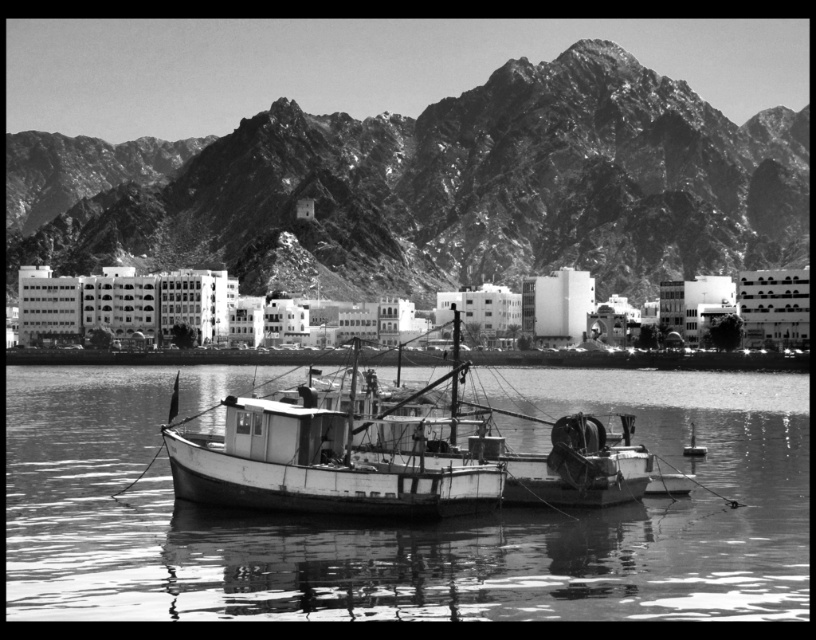
You are a photographer planning to capture the rugged stone mountain at upper center and the white wooden boat at center in a single frame. Based on their sizes in the image, which object will appear larger in your photograph?

The rugged stone mountain at upper center will appear larger in the photograph because it is taller than the white wooden boat at center.

You are a hiker standing at the base of the rugged stone mountain at upper center. The mountain is located at coordinates point (433, 188). You want to reach the summit. What direction should you head to ascend the mountain?

The rugged stone mountain at upper center is located at point (433, 188). To ascend the mountain, you should head towards the upper direction from your current position at the base.

You are a photographer planning to capture the rugged stone mountain at upper center and the smooth white water at center in a single frame. Based on their sizes, which object should you focus on first to ensure it is fully visible in the photo?

The rugged stone mountain at upper center is bigger than the smooth white water at center, so you should focus on the rugged stone mountain at upper center first to ensure its full visibility in the photo.